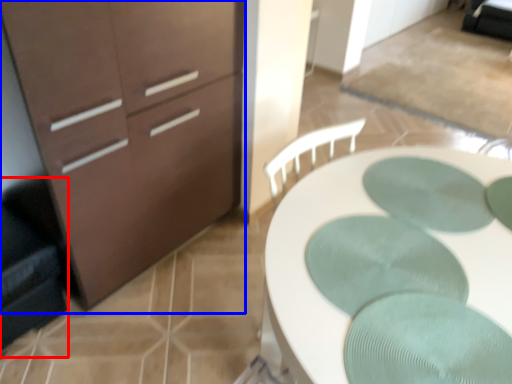
Question: Which point is further to the camera, swivel chair (highlighted by a red box) or chest of drawers (highlighted by a blue box)?

Choices:
 (A) swivel chair
 (B) chest of drawers

Answer: (A)